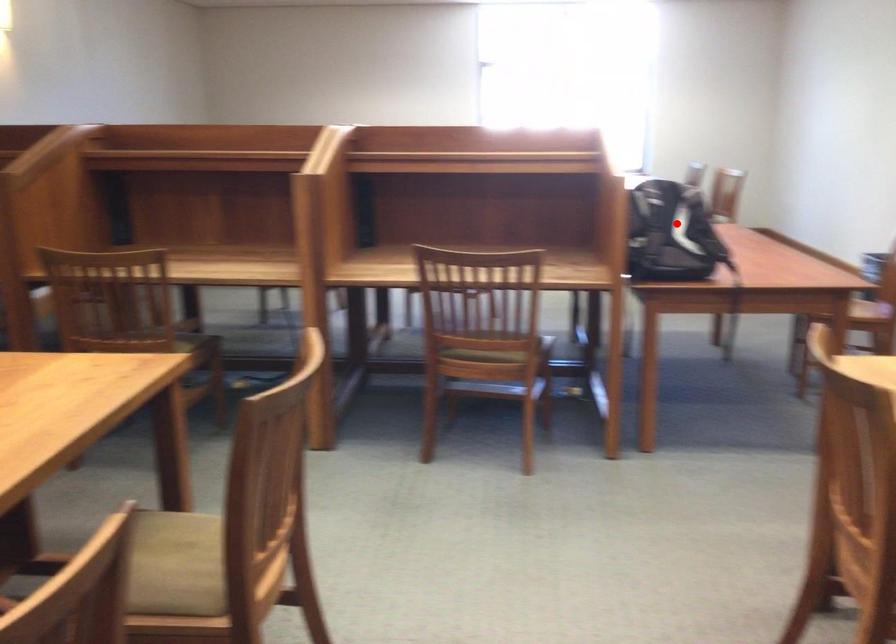
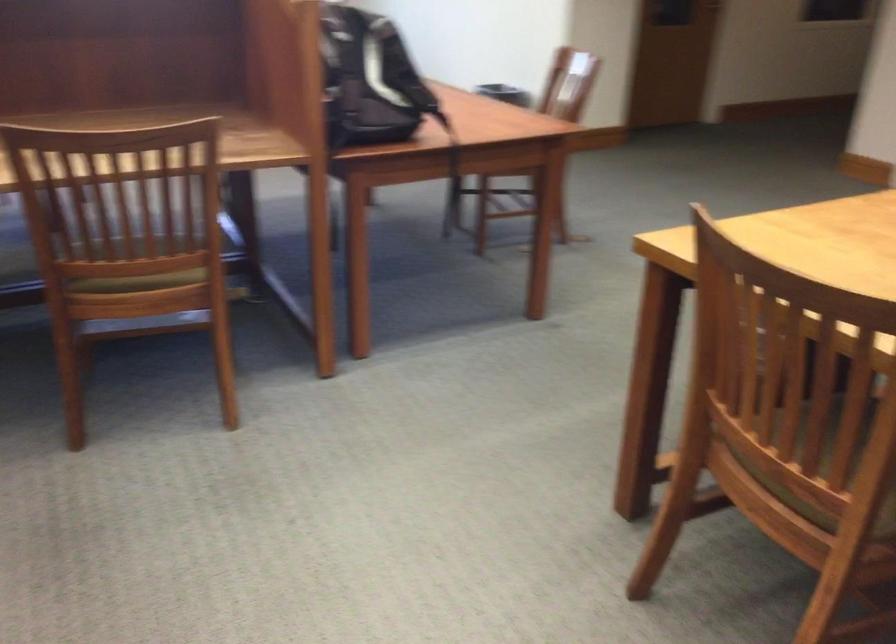
Question: I am providing you with two images of the same scene from different viewpoints. In image1, a red point is highlighted. Considering the same 3D point in image2, which of the following is correct?

Choices:
 (A) It is closer
 (B) It is farther

Answer: (A)